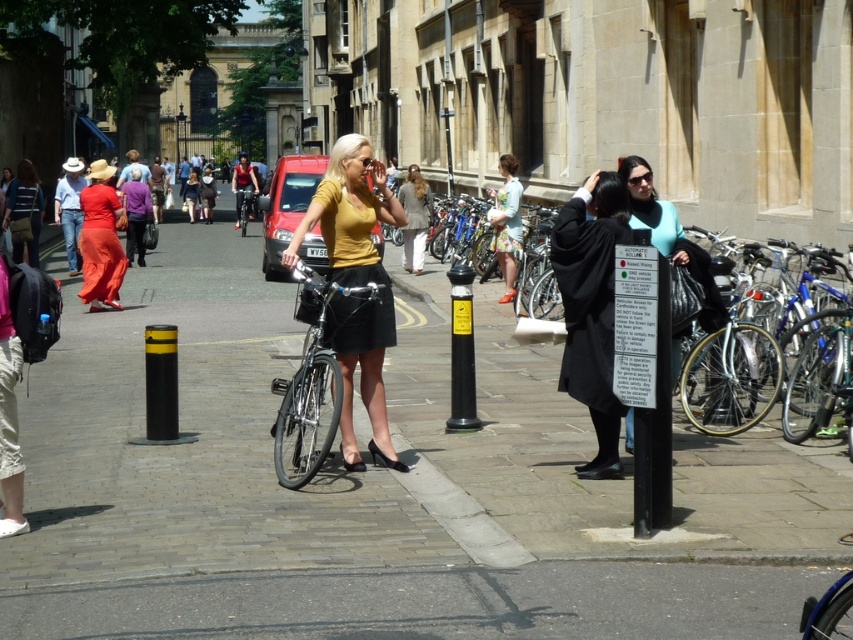
This screenshot has width=853, height=640. In order to click on light blue fabric dress at center in this screenshot , I will do `click(508, 224)`.

Does light blue fabric dress at center lie in front of light beige cotton pants at center?

Yes, light blue fabric dress at center is closer to the viewer.

Which is behind, point (502, 163) or point (415, 244)?

The point (415, 244) is behind.

You are a GUI agent. You are given a task and a screenshot of the screen. Output one action in this format:
    pyautogui.click(x=<x>, y=<y>)
    Task: Click on the light blue fabric dress at center
    
    Given the screenshot: What is the action you would take?
    pyautogui.click(x=508, y=224)

Which of these two, smooth concrete pavement at center or black smooth pole at center, stands taller?

smooth concrete pavement at center

This screenshot has width=853, height=640. What do you see at coordinates (376, 492) in the screenshot?
I see `smooth concrete pavement at center` at bounding box center [376, 492].

Which is in front, point (376, 584) or point (451, 406)?

Point (376, 584)

Locate an element on the screen. Image resolution: width=853 pixels, height=640 pixels. smooth concrete pavement at center is located at coordinates 376,492.

Does point (373, 374) come behind point (91, 260)?

No.

Looking at this image, is yellow matte shirt at center further to the viewer compared to matte red dress at left?

No.

Is point (380, 172) farther from viewer compared to point (90, 214)?

No.

Find the location of a particular element. yellow matte shirt at center is located at coordinates (355, 284).